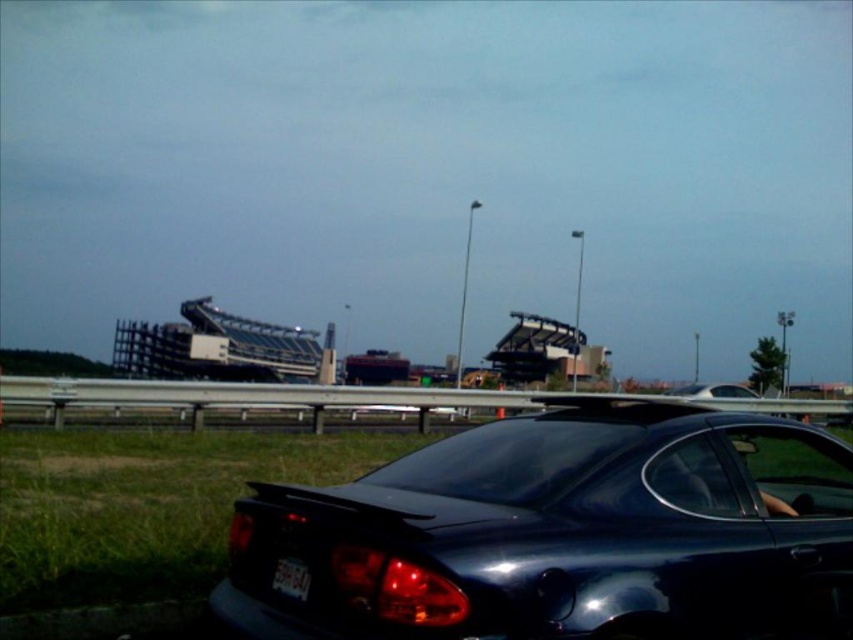
In the scene shown: Does glossy dark blue car at lower center have a lesser height compared to white plastic license plate at lower center?

In fact, glossy dark blue car at lower center may be taller than white plastic license plate at lower center.

Is glossy dark blue car at lower center further to camera compared to white plastic license plate at lower center?

No.

Is point (585, 512) more distant than point (296, 584)?

Yes, point (585, 512) is behind point (296, 584).

Where is `glossy dark blue car at lower center`? glossy dark blue car at lower center is located at coordinates (563, 532).